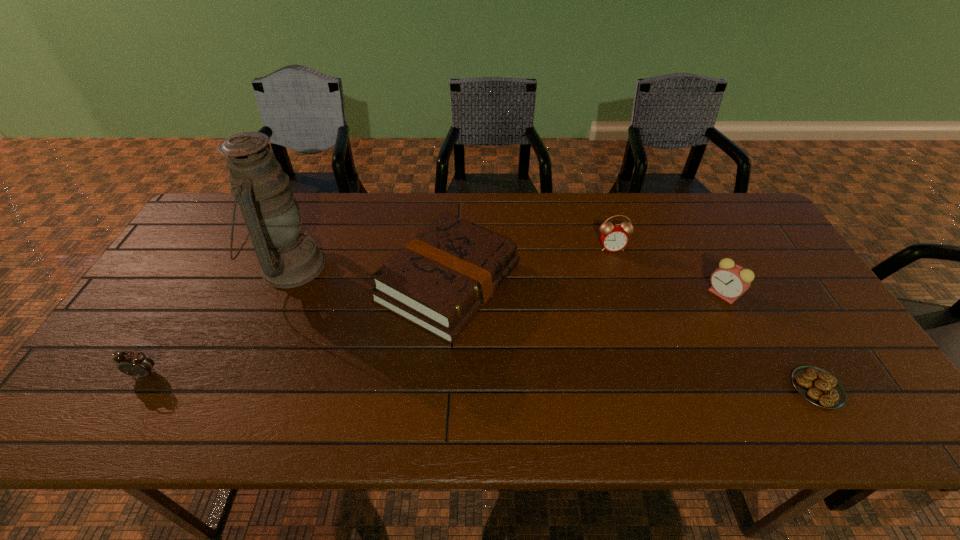
Where is `pastry`? Image resolution: width=960 pixels, height=540 pixels. pastry is located at coordinates (816, 385).

The height and width of the screenshot is (540, 960). I want to click on vacant space located 0.200m on the right of the tallest object, so click(393, 266).

Where is `vacant space located 0.380m on the clock face of the second alarm clock from left to right`? The width and height of the screenshot is (960, 540). vacant space located 0.380m on the clock face of the second alarm clock from left to right is located at coordinates (646, 360).

Identify the location of free location located 0.300m on the face of the rightmost alarm clock. (598, 294).

The height and width of the screenshot is (540, 960). I want to click on free space located 0.050m on the face of the rightmost alarm clock, so click(x=689, y=294).

The height and width of the screenshot is (540, 960). I want to click on vacant space located on the face of the rightmost alarm clock, so click(679, 294).

This screenshot has width=960, height=540. What are the coordinates of `free location located 0.180m on the left of the hardback book` in the screenshot? It's located at (312, 283).

This screenshot has height=540, width=960. Identify the location of vacant region located 0.080m on the face of the leftmost alarm clock. pos(122,411).

Locate an element on the screen. This screenshot has width=960, height=540. free space located on the left of the shortest object is located at coordinates (706, 388).

Identify the location of oil lamp present at the far edge. This screenshot has height=540, width=960. (288, 258).